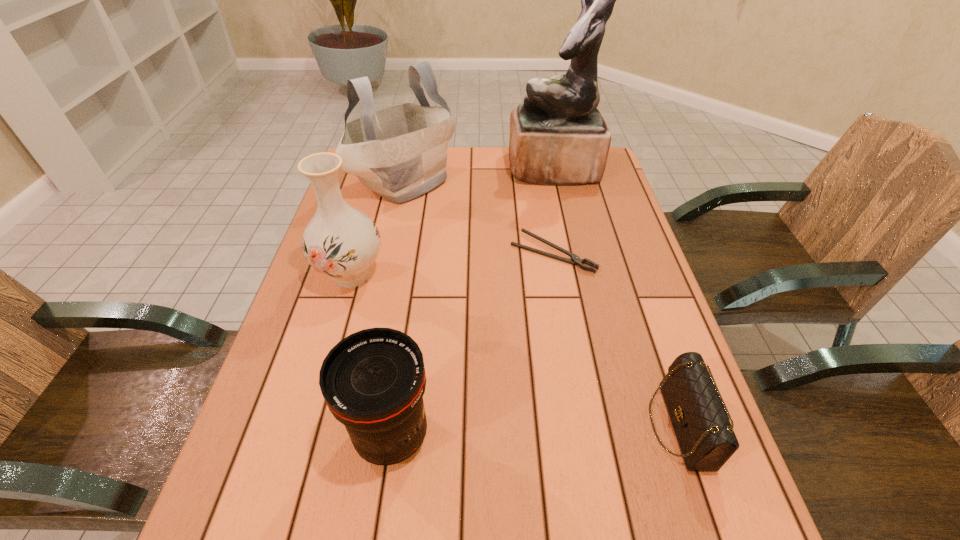
Where is `sculpture that is at the right edge`? The height and width of the screenshot is (540, 960). sculpture that is at the right edge is located at coordinates (x=558, y=136).

At what (x,y) coordinates should I click in order to perform the action: click on clutch bag present at the right edge. Please return your answer as a coordinate pair (x, y). This screenshot has height=540, width=960. Looking at the image, I should click on (699, 416).

Find the location of a particular element. This screenshot has width=960, height=540. tongs situated at the right edge is located at coordinates (575, 260).

Find the location of a particular element. The width and height of the screenshot is (960, 540). object present at the far left corner is located at coordinates (400, 153).

Find the location of a particular element. The width and height of the screenshot is (960, 540). object that is at the far right corner is located at coordinates (558, 136).

In the image, there is a desktop. Where is `free space at the far edge`? Image resolution: width=960 pixels, height=540 pixels. free space at the far edge is located at coordinates (476, 157).

You are a GUI agent. You are given a task and a screenshot of the screen. Output one action in this format:
    pyautogui.click(x=<x>, y=<y>)
    Task: Click on the free location at the left edge of the desktop
    This screenshot has height=540, width=960.
    Given the screenshot: What is the action you would take?
    pyautogui.click(x=351, y=299)

Locate an element on the screen. This screenshot has height=540, width=960. vacant space at the right edge is located at coordinates (624, 369).

Where is `free area in between the shopping bag and the vase`? The height and width of the screenshot is (540, 960). free area in between the shopping bag and the vase is located at coordinates (378, 228).

Where is `free space between the tongs and the shopping bag`? The width and height of the screenshot is (960, 540). free space between the tongs and the shopping bag is located at coordinates (479, 218).